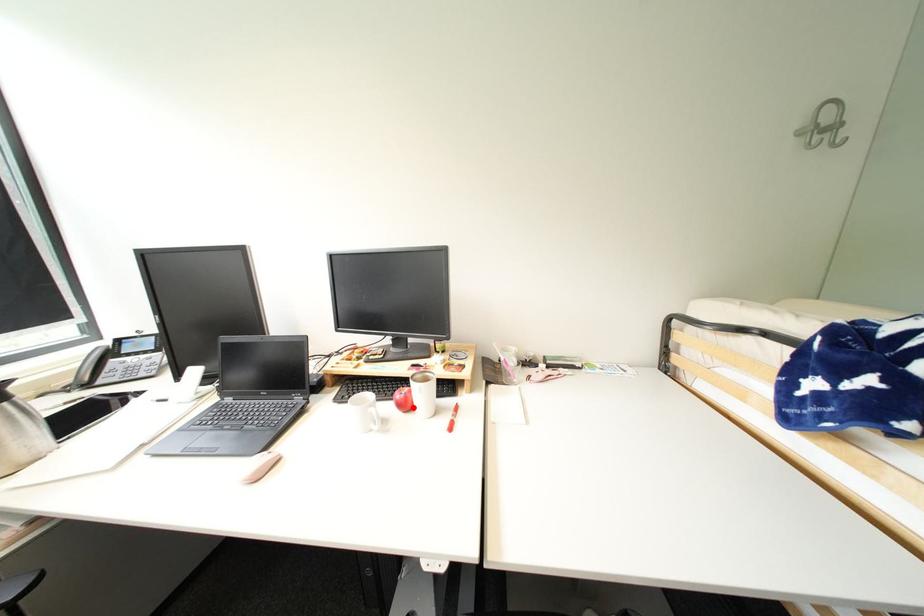
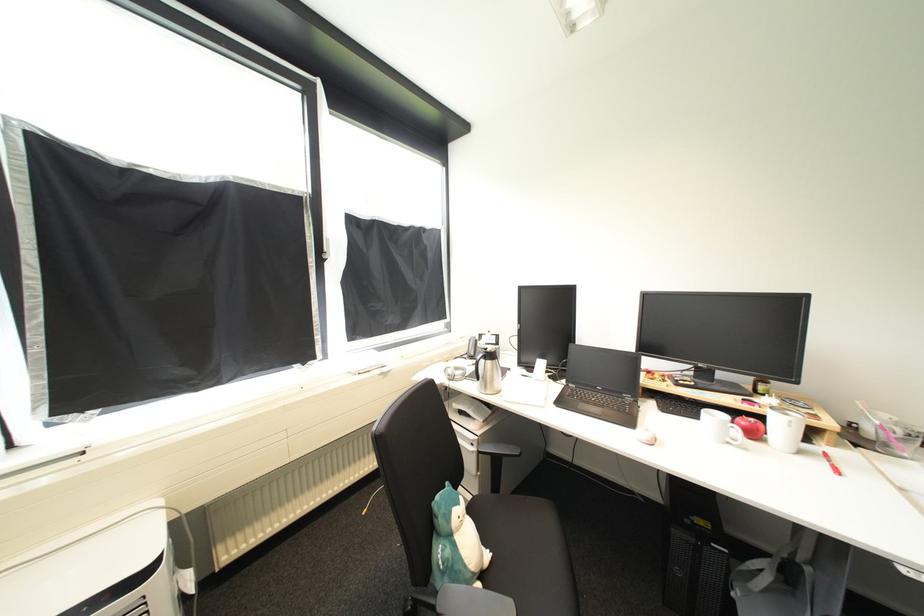
Locate, in the second image, the point that corresponds to the highlighted location in the first image.

(761, 436)